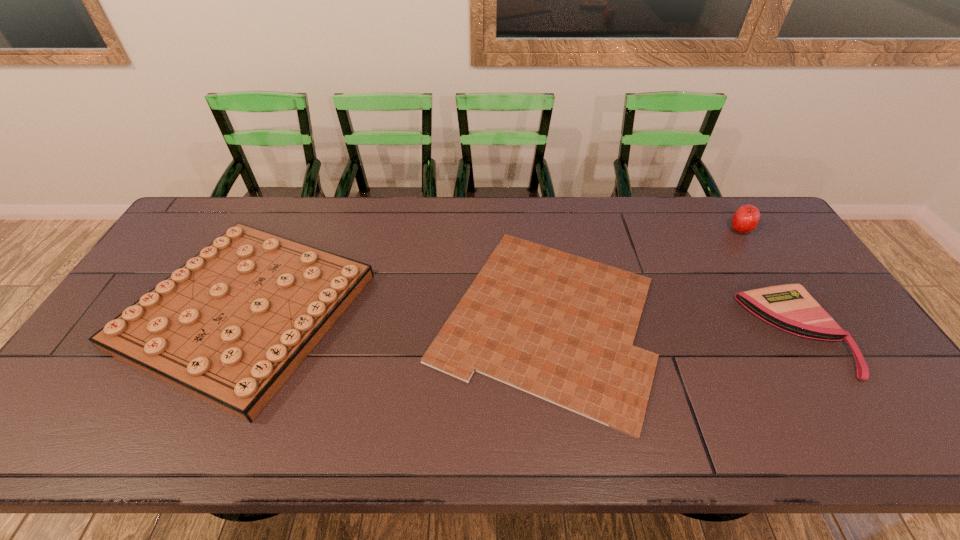
The height and width of the screenshot is (540, 960). In order to click on apple in this screenshot , I will do `click(746, 218)`.

Find the location of a particular element. the taller gameboard is located at coordinates (230, 326).

Where is `the leftmost object`? The height and width of the screenshot is (540, 960). the leftmost object is located at coordinates coord(230,326).

The height and width of the screenshot is (540, 960). In order to click on the second shortest object in this screenshot , I will do `click(789, 307)`.

This screenshot has width=960, height=540. Identify the location of the right gameboard. (561, 327).

At what (x,y) coordinates should I click in order to perform the action: click on the shortest object. Please return your answer as a coordinate pair (x, y). Looking at the image, I should click on (561, 327).

What are the coordinates of `free space located 0.050m on the left of the tallest object` in the screenshot? It's located at (714, 230).

In order to click on free space located 0.370m on the right of the third shortest object in this screenshot , I will do tap(497, 310).

The image size is (960, 540). Identify the location of vacant space located 0.190m on the left of the third tallest object. (680, 332).

Where is `vacant space located on the right of the third object from right to left`? The width and height of the screenshot is (960, 540). vacant space located on the right of the third object from right to left is located at coordinates (736, 318).